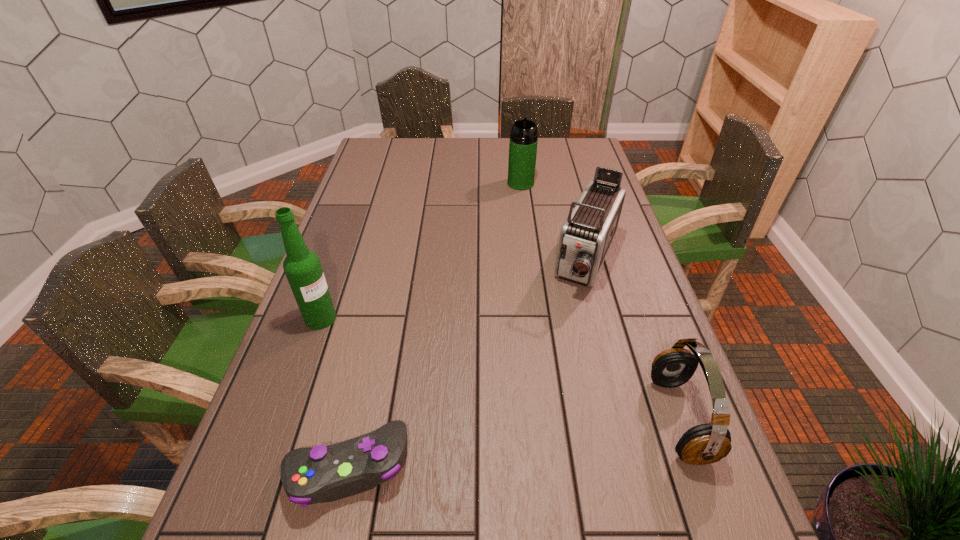
Image resolution: width=960 pixels, height=540 pixels. What are the coordinates of `vacant spot on the desktop that is between the control and the headset and is positioned from the spout of the third object from right to left` in the screenshot? It's located at (537, 439).

The height and width of the screenshot is (540, 960). Find the location of `free space on the desktop that is between the shortest object and the fourth tallest object and is positioned on the label of the beer bottle`. free space on the desktop that is between the shortest object and the fourth tallest object and is positioned on the label of the beer bottle is located at coordinates (525, 441).

Identify the location of free spot on the desktop that is between the shortest object and the headset and is positioned at the lens of the second farthest object. This screenshot has height=540, width=960. (499, 444).